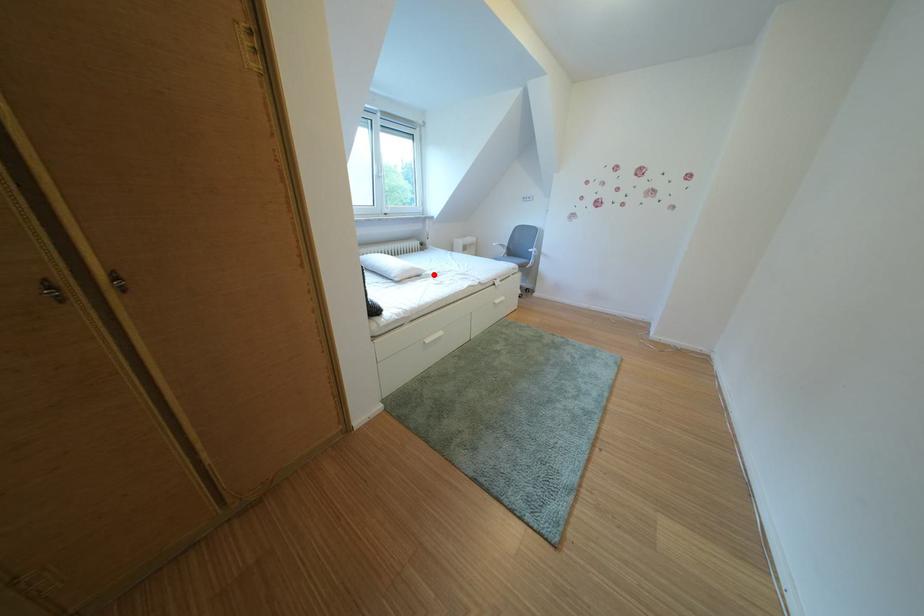
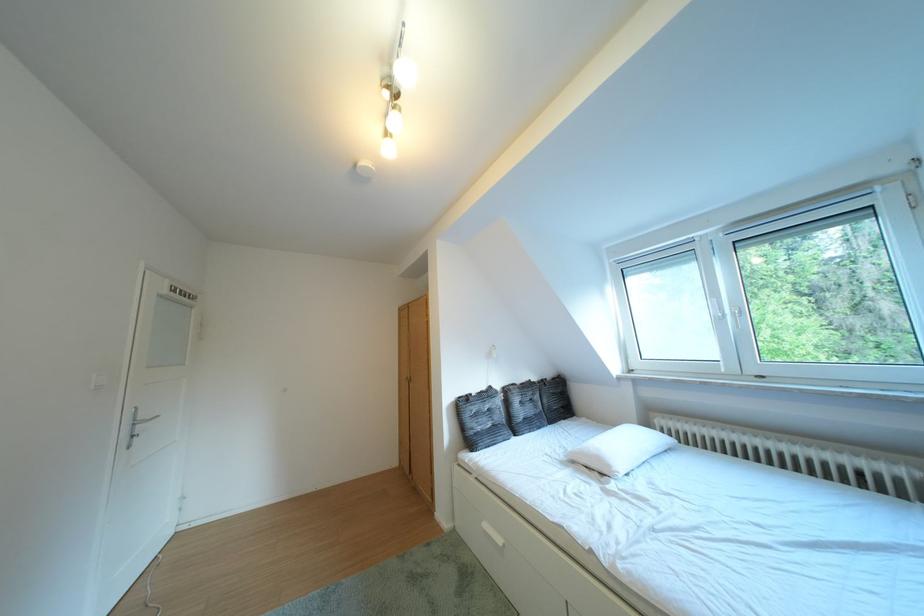
Locate, in the second image, the point that corresponds to the highlighted location in the first image.

(623, 471)